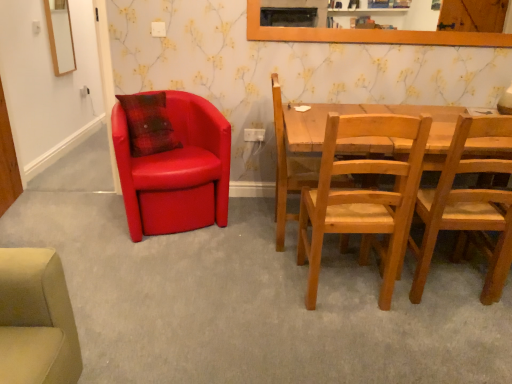
I want to click on vacant space that is in between wooden chair at center, arranged as the 2th chair when viewed from the left, and natural wood chair at center, placed as the second chair when sorted from right to left, so click(298, 268).